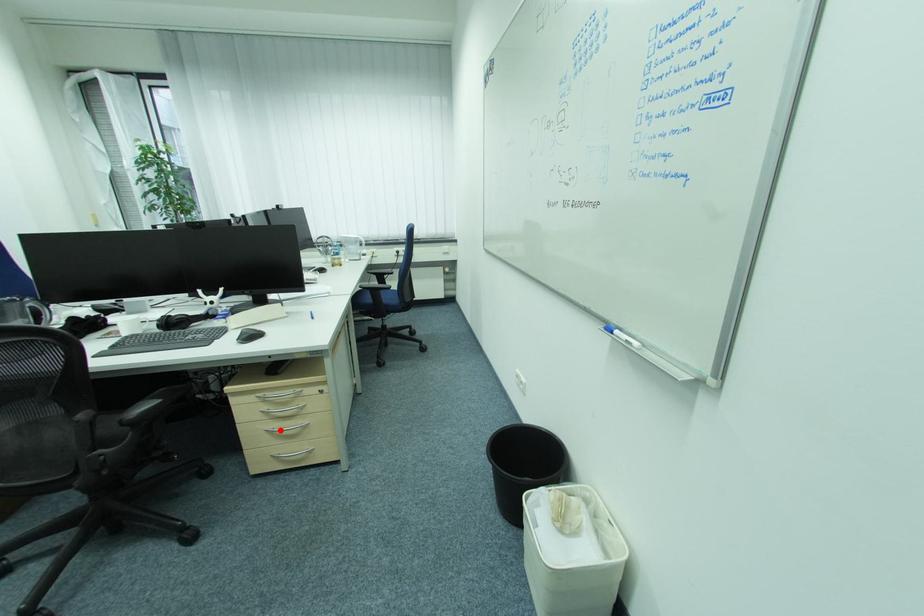
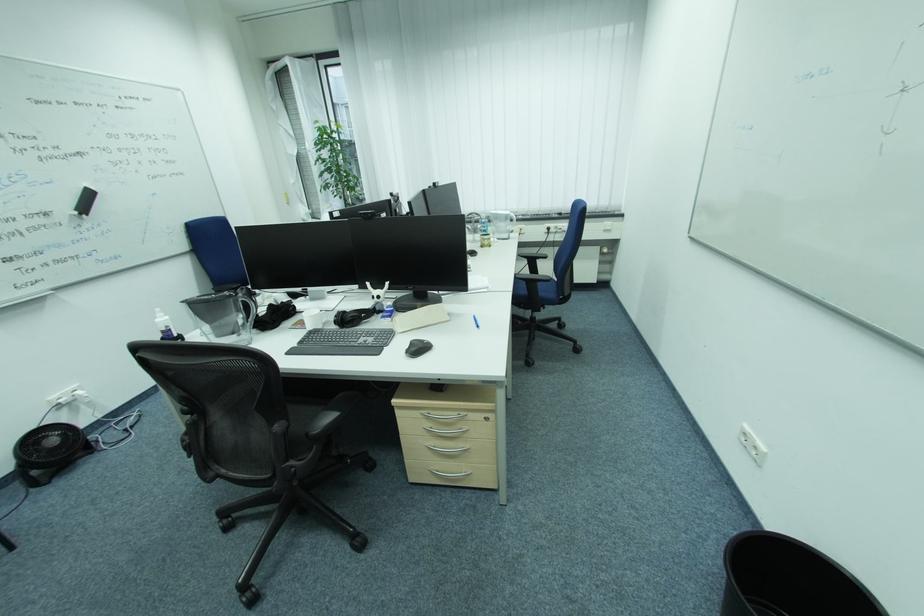
The point at the highlighted location is marked in the first image. Where is the corresponding point in the second image?

(441, 448)